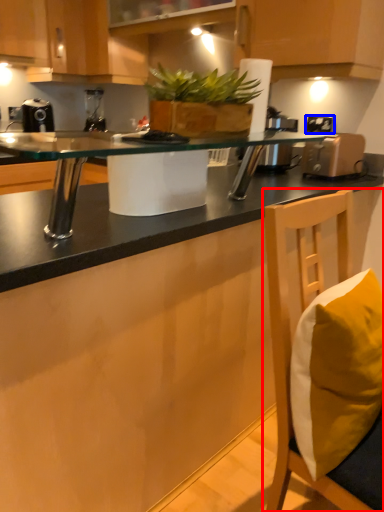
Question: Among these objects, which one is nearest to the camera, chair (highlighted by a red box) or electric outlet (highlighted by a blue box)?

Choices:
 (A) chair
 (B) electric outlet

Answer: (A)